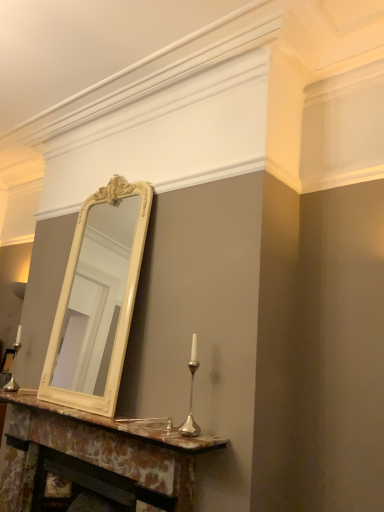
This screenshot has width=384, height=512. Find the location of `marble fireplace at lower center`. marble fireplace at lower center is located at coordinates (96, 458).

The height and width of the screenshot is (512, 384). What do you see at coordinates (96, 458) in the screenshot? I see `marble fireplace at lower center` at bounding box center [96, 458].

At what (x,y) coordinates should I click in order to perform the action: click on marble fireplace at lower center. Please return your answer as a coordinate pair (x, y). Looking at the image, I should click on (96, 458).